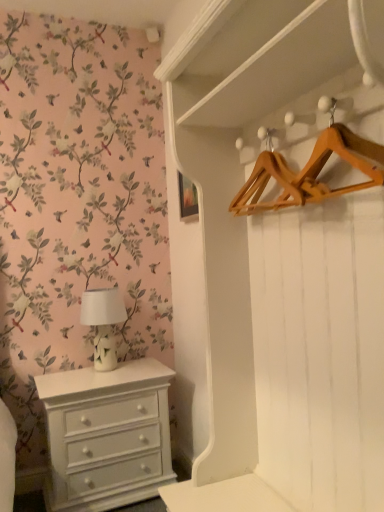
Where is `free spot above wooden hanger at upper right (from a real-world perspective)`? This screenshot has height=512, width=384. free spot above wooden hanger at upper right (from a real-world perspective) is located at coordinates (279, 124).